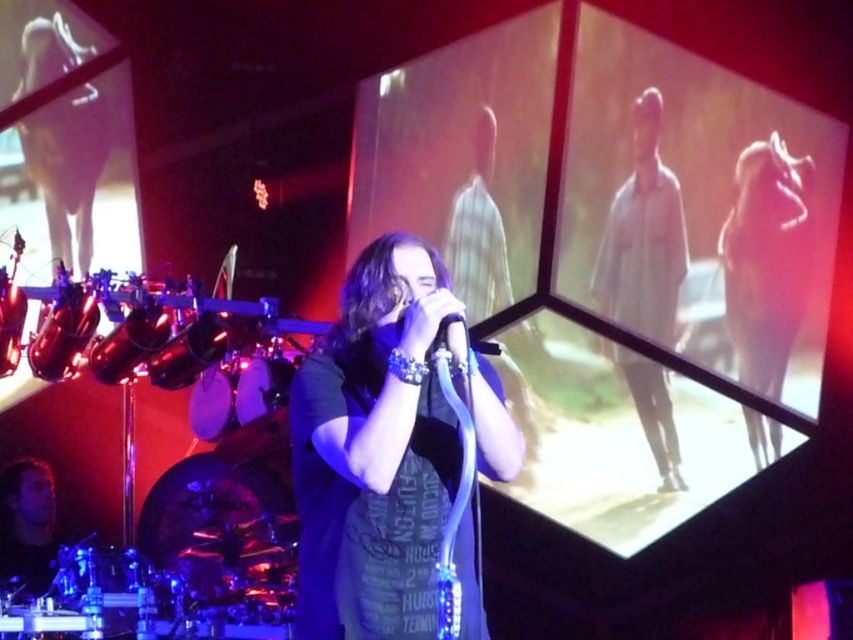
Consider the image. You are a photographer at the concert venue and want to capture the performer wearing the dark blue t shirt at center. You notice a point at coordinates (375, 449). Where is this point located on the performer?

The point at coordinates (375, 449) is on the dark blue t shirt at center.